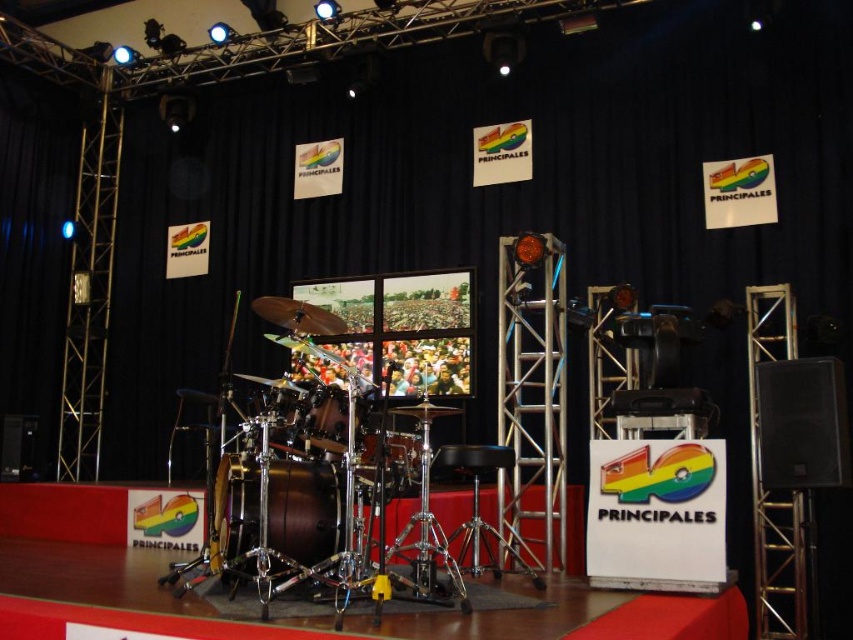
Question: Among these points, which one is farthest from the camera?

Choices:
 (A) (311, 428)
 (B) (376, 444)

Answer: (A)

Question: Is mahogany polished wood drum at center below shiny gold drum at center?

Choices:
 (A) yes
 (B) no

Answer: (A)

Question: Among these objects, which one is nearest to the camera?

Choices:
 (A) shiny gold drum at center
 (B) mahogany polished wood drum at center
 (C) shiny brown drum at center

Answer: (A)

Question: Can you confirm if mahogany polished wood drum at center is smaller than shiny gold drum at center?

Choices:
 (A) no
 (B) yes

Answer: (A)

Question: Which point is farther from the camera taking this photo?

Choices:
 (A) (318, 440)
 (B) (379, 436)
 (C) (317, 472)

Answer: (C)

Question: Can you confirm if shiny gold drum at center is smaller than shiny brown drum at center?

Choices:
 (A) no
 (B) yes

Answer: (A)